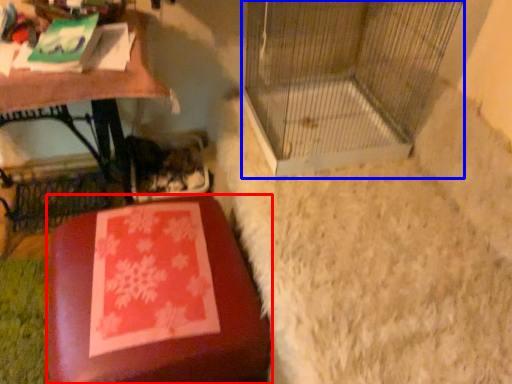
Question: Which point is further to the camera, furniture (highlighted by a red box) or bird cage (highlighted by a blue box)?

Choices:
 (A) furniture
 (B) bird cage

Answer: (B)